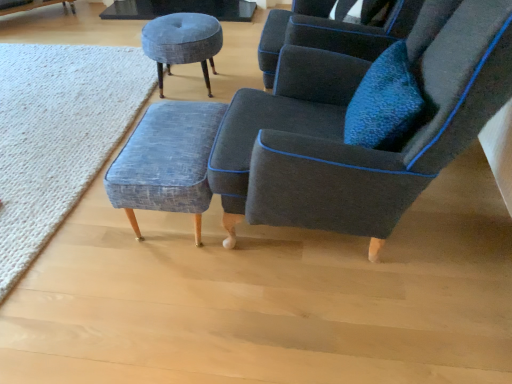
Where is `free region under dark gray fabric chair at center (from a real-world perspective)`? This screenshot has height=384, width=512. free region under dark gray fabric chair at center (from a real-world perspective) is located at coordinates (348, 248).